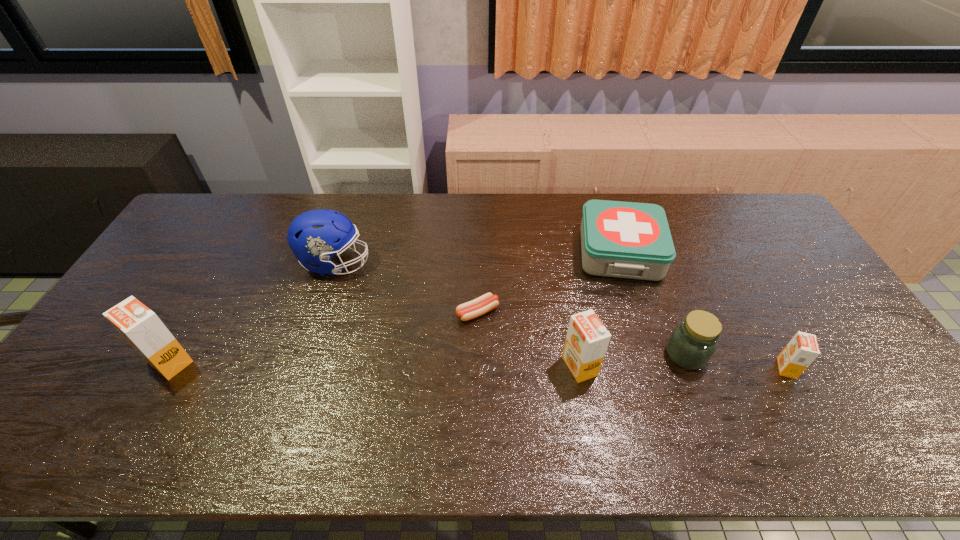
Find the location of a particular element. vacant spot for a new orange_juice to ensure equal spacing is located at coordinates (374, 364).